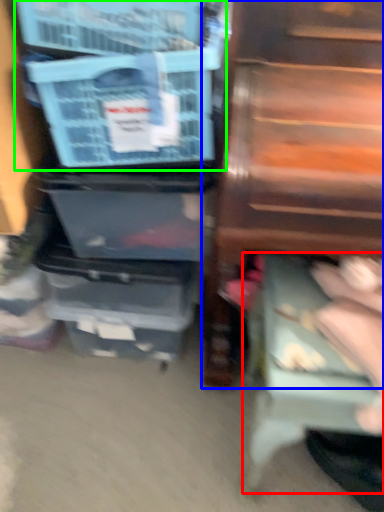
Question: Which is nearer to the step stool (highlighted by a red box)? furniture (highlighted by a blue box) or storage box (highlighted by a green box).

Choices:
 (A) furniture
 (B) storage box

Answer: (A)